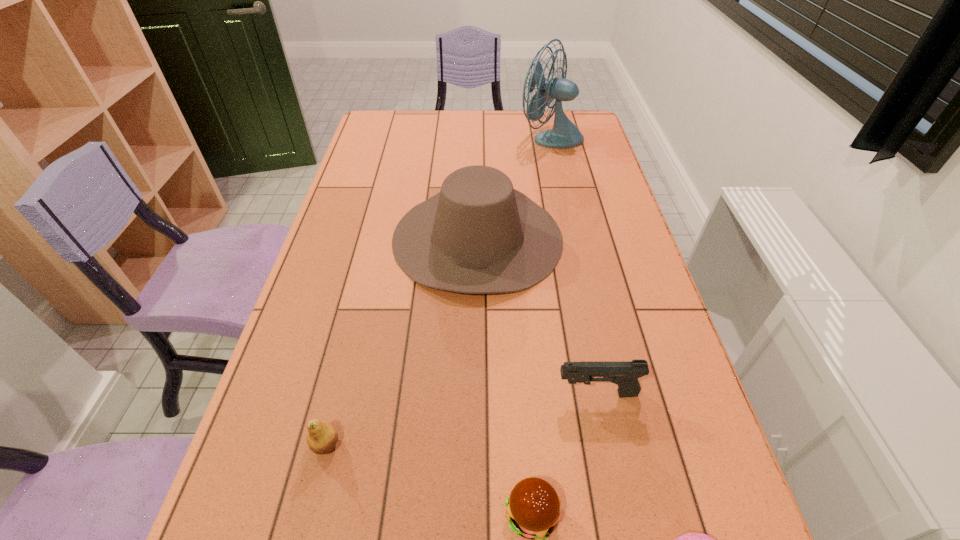
Where is `the farthest object`? the farthest object is located at coordinates (564, 134).

Where is `fan`? This screenshot has width=960, height=540. fan is located at coordinates (564, 134).

I want to click on the second farthest object, so click(x=478, y=235).

Image resolution: width=960 pixels, height=540 pixels. Find the location of `the second tallest object`. the second tallest object is located at coordinates (478, 235).

In order to click on the third nearest object in this screenshot , I will do `click(322, 437)`.

In order to click on the leftmost object in this screenshot , I will do `click(322, 437)`.

Image resolution: width=960 pixels, height=540 pixels. Identify the location of pistol. (625, 374).

Identify the location of vacant space located in front of the tallest object to blow air. (413, 138).

Locate an element on the screen. free spot located 0.330m in front of the tallest object to blow air is located at coordinates [x=428, y=138].

Locate an element on the screen. free location located 0.350m in front of the tallest object to blow air is located at coordinates (423, 138).